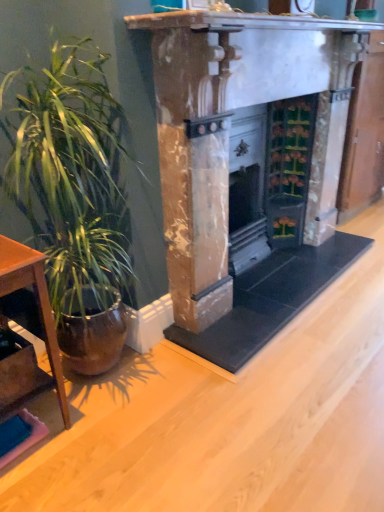
Question: In terms of width, does green glossy plant at left look wider or thinner when compared to brown wooden table at left?

Choices:
 (A) wide
 (B) thin

Answer: (A)

Question: From a real-world perspective, is green glossy plant at left positioned above or below brown wooden table at left?

Choices:
 (A) below
 (B) above

Answer: (B)

Question: Estimate the real-world distances between objects in this image. Which object is closer to the green glossy plant at left?

Choices:
 (A) marble fireplace at center
 (B) brown wooden table at left

Answer: (B)

Question: Which object is the closest to the brown wooden table at left?

Choices:
 (A) marble fireplace at center
 (B) green glossy plant at left

Answer: (B)